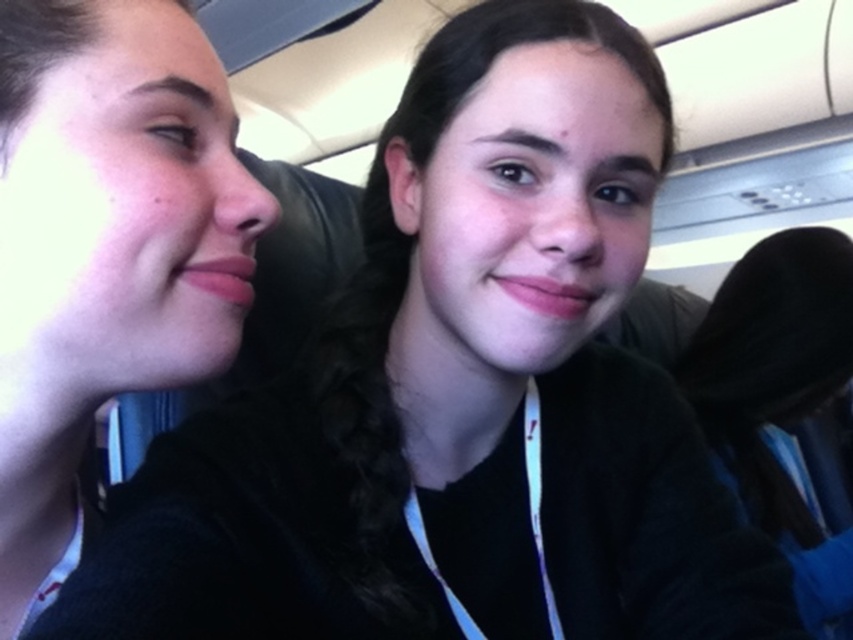
Does black fabric at left have a lesser height compared to black fabric at right?

Yes.

What do you see at coordinates (105, 248) in the screenshot? I see `black fabric at left` at bounding box center [105, 248].

Between point (178, 61) and point (833, 394), which one is positioned behind?

Positioned behind is point (833, 394).

This screenshot has width=853, height=640. Find the location of `black fabric at left`. black fabric at left is located at coordinates (105, 248).